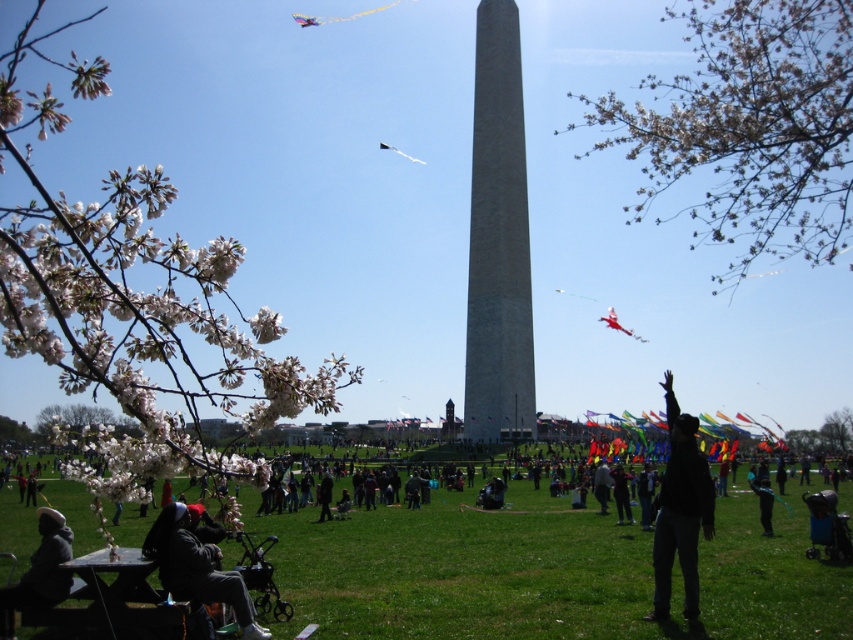
Based on the scene description, what is located at the coordinates point (465,570)?

The green grassy field at lower center is located at point (465,570).

You are a photographer trying to capture a photo of the shiny red kite at center without including the dark gray hoodie at lower left in the frame. Based on their sizes, which object should you focus on to ensure the hoodie is out of the shot?

The dark gray hoodie at lower left is larger than the shiny red kite at center. To avoid including the hoodie, focus on the shiny red kite at center since it is smaller and positioned centrally, allowing you to frame the shot to exclude the larger hoodie on the side.